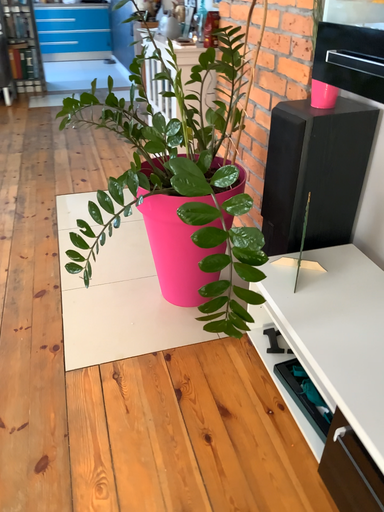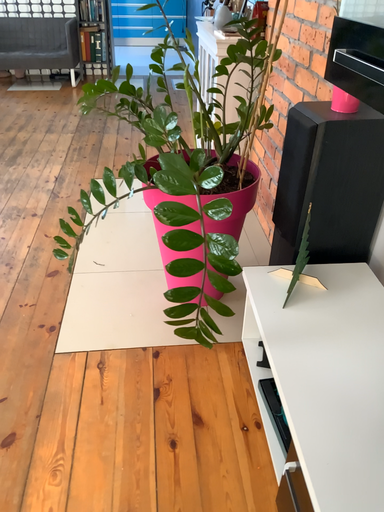
Question: How did the camera likely rotate when shooting the video?

Choices:
 (A) rotated left
 (B) rotated right

Answer: (A)